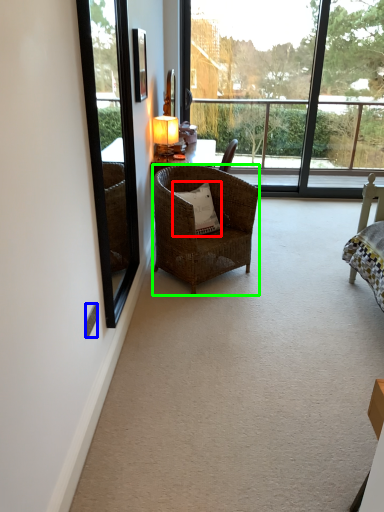
Question: Which object is the farthest from pillow (highlighted by a red box)? Choose among these: power outlet (highlighted by a blue box) or chair (highlighted by a green box).

Choices:
 (A) power outlet
 (B) chair

Answer: (A)